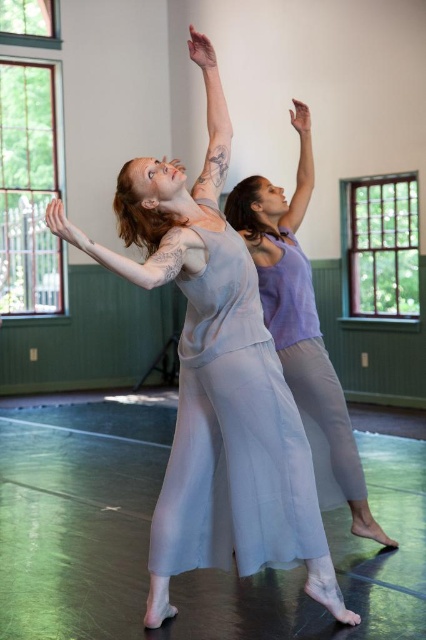
Based on the photo, you are a photographer setting up a shot in the dance studio. You want to place a light exactly halfway between the two points marked as point [192,234] and point [307,166]. Based on their positions, will the light be closer to the foreground dancer or the background dancer?

The light placed halfway between point [192,234] and point [307,166] will be closer to the foreground dancer because point [192,234] is closer to the camera than point [307,166].

You are a photographer setting up in a dance studio. You need to position a light at coordinates point 0.402, 0.296 to illuminate the matte gray arm at upper left. Which object in the scene is at those coordinates?

The matte gray arm at upper left is located at point (126, 257).